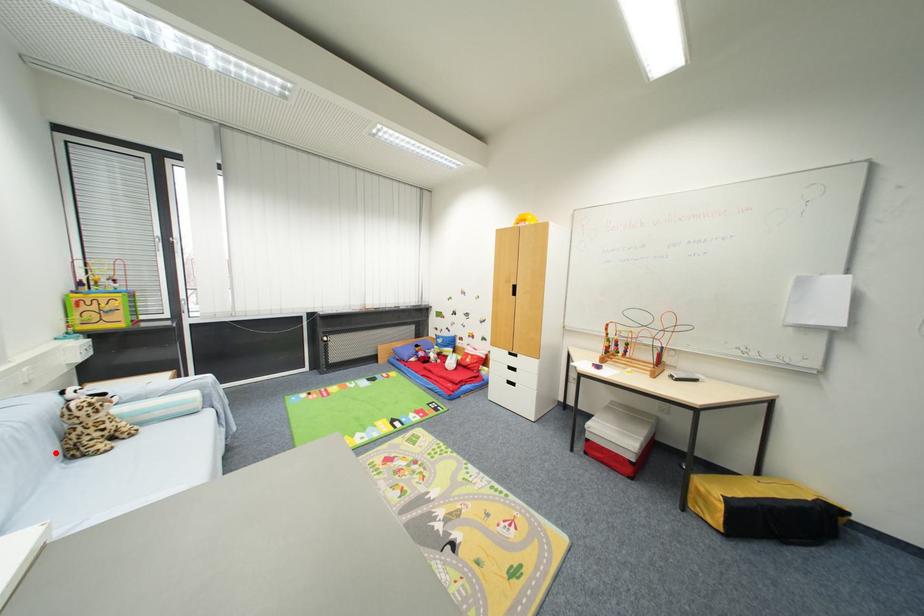
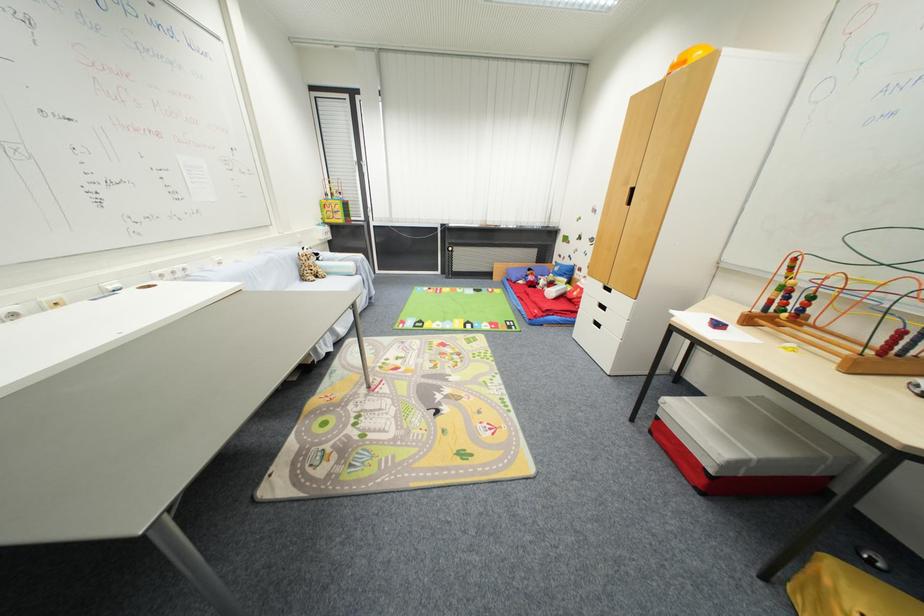
Question: I am providing you with two images of the same scene from different viewpoints. Image1 has a red point marked. In image2, the corresponding 3D location appears at what relative position? Reply with the corresponding letter.

Choices:
 (A) Closer
 (B) Farther

Answer: (A)